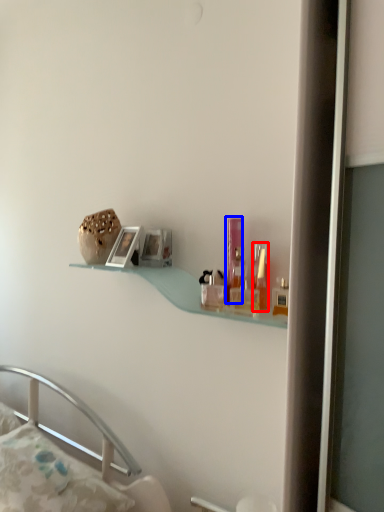
Question: Which object is closer to the camera taking this photo, toiletry (highlighted by a red box) or toiletry (highlighted by a blue box)?

Choices:
 (A) toiletry
 (B) toiletry

Answer: (A)